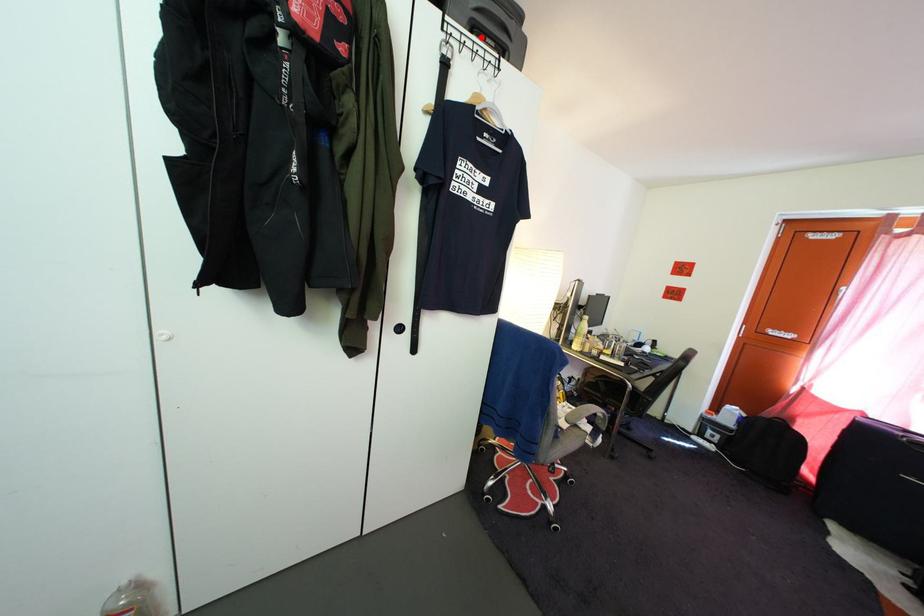
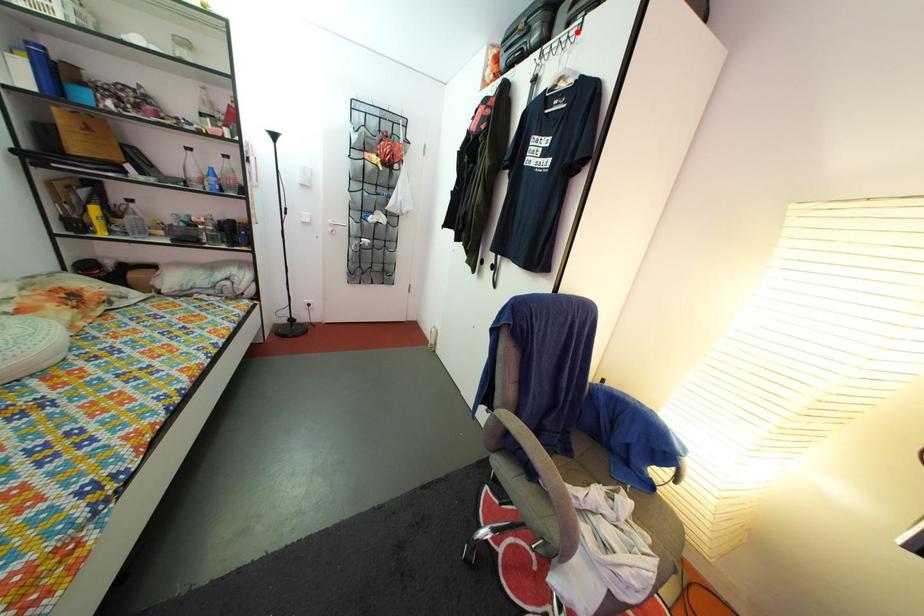
I am providing you with two images of the same scene from different viewpoints. A red point is marked on the first image and another point is marked on the second image. Does the point marked in image1 correspond to the same location as the one in image2?

Yes